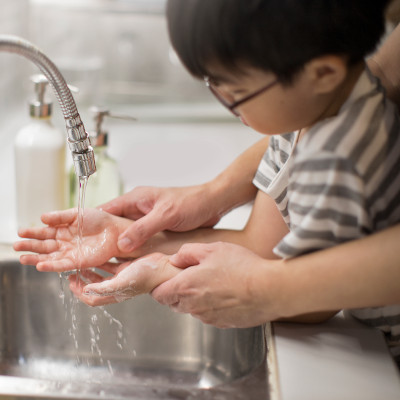
The height and width of the screenshot is (400, 400). Identify the location of sink basin. (155, 331).